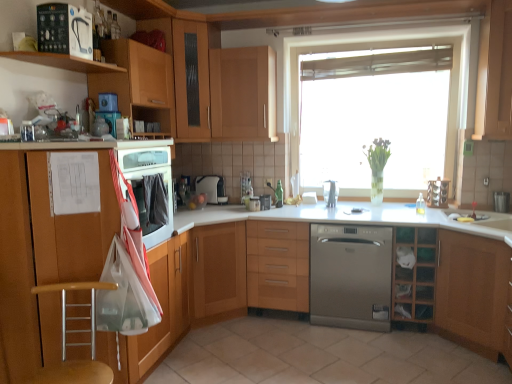
Question: Considering the positions of light wood/wooden cabinet at center, which is counted as the sixth cabinetry, starting from the left, and wooden cabinet at lower right, which is the second cabinetry from right to left, in the image, is light wood/wooden cabinet at center, which is counted as the sixth cabinetry, starting from the left, bigger or smaller than wooden cabinet at lower right, which is the second cabinetry from right to left,?

Choices:
 (A) big
 (B) small

Answer: (B)

Question: Is light wood/wooden cabinet at center, which is the third cabinetry in right-to-left order, in front of or behind wooden cabinet at lower right, marked as the 7th cabinetry in a left-to-right arrangement, in the image?

Choices:
 (A) front
 (B) behind

Answer: (B)

Question: Which object is the farthest from the matte wood cabinet at left, which is counted as the 8th cabinetry, starting from the right?

Choices:
 (A) wooden seat at lower left
 (B) satin stainless steel dishwasher at lower center
 (C) wooden shelf at upper left, the first shelf in the front-to-back sequence
 (D) wooden cabinet at upper left, placed as the seventh cabinetry when sorted from right to left
 (E) satin wood floor at center

Answer: (B)

Question: Which of these objects is positioned farthest from the wooden cabinet at upper center, which ranks as the 6th cabinetry in right-to-left order?

Choices:
 (A) wooden cabinet at upper center, arranged as the fourth cabinetry when viewed from the right
 (B) wooden seat at lower left
 (C) black plastic water filter at upper left, the 1th kitchen appliance positioned from the left
 (D) wooden cabinet at upper left, placed as the seventh cabinetry when sorted from right to left
 (E) white glossy coffee maker at center, the first kitchen appliance when ordered from bottom to top

Answer: (B)